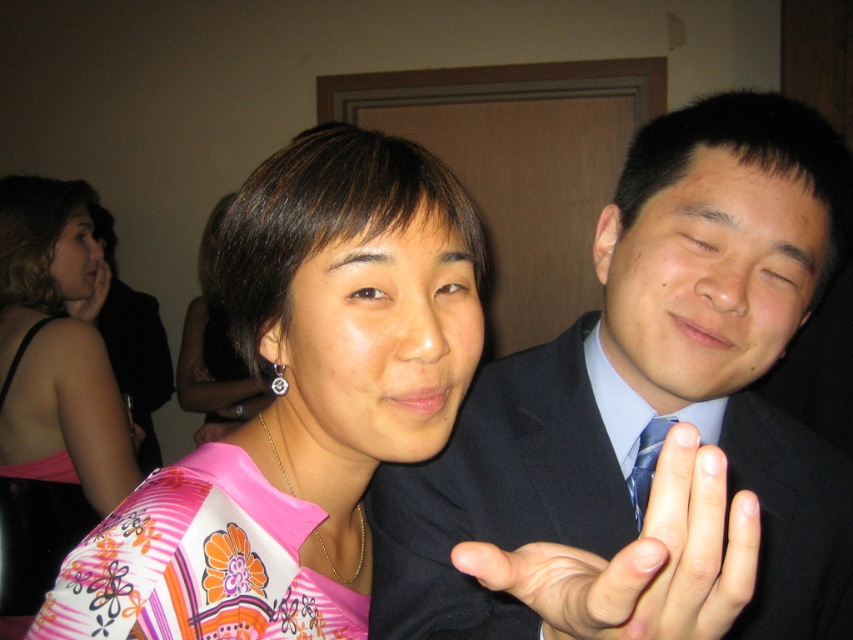
Question: Is floral-patterned fabric dress at center further to camera compared to pink fabric hand at center?

Choices:
 (A) no
 (B) yes

Answer: (A)

Question: In this image, where is pink floral dress at center located relative to pink fabric hand at center?

Choices:
 (A) left
 (B) right

Answer: (A)

Question: Which of these objects is positioned farthest from the matte black suit at right?

Choices:
 (A) floral-patterned fabric dress at center
 (B) pink floral fabric dress at left
 (C) pink fabric shirt at center

Answer: (B)

Question: Which point is farther to the camera?

Choices:
 (A) (218, 429)
 (B) (254, 634)
 (C) (129, 540)
 (D) (68, 435)

Answer: (A)

Question: Is pink fabric shirt at center closer to camera compared to blue silk tie at center?

Choices:
 (A) no
 (B) yes

Answer: (B)

Question: Estimate the real-world distances between objects in this image. Which object is closer to the smooth skin hands at center?

Choices:
 (A) blue silk tie at center
 (B) pink floral dress at center
 (C) pink fabric at center

Answer: (A)